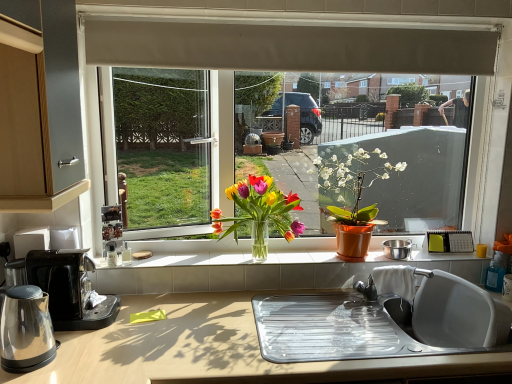
The height and width of the screenshot is (384, 512). What are the coordinates of `unoccupied region to the right of black plastic coffee maker at lower left` in the screenshot? It's located at (150, 330).